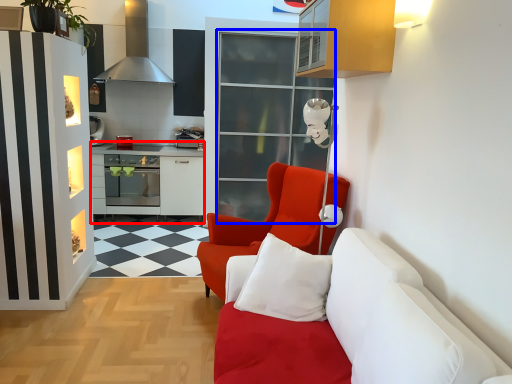
Question: Among these objects, which one is farthest to the camera, table (highlighted by a red box) or glass door (highlighted by a blue box)?

Choices:
 (A) table
 (B) glass door

Answer: (A)